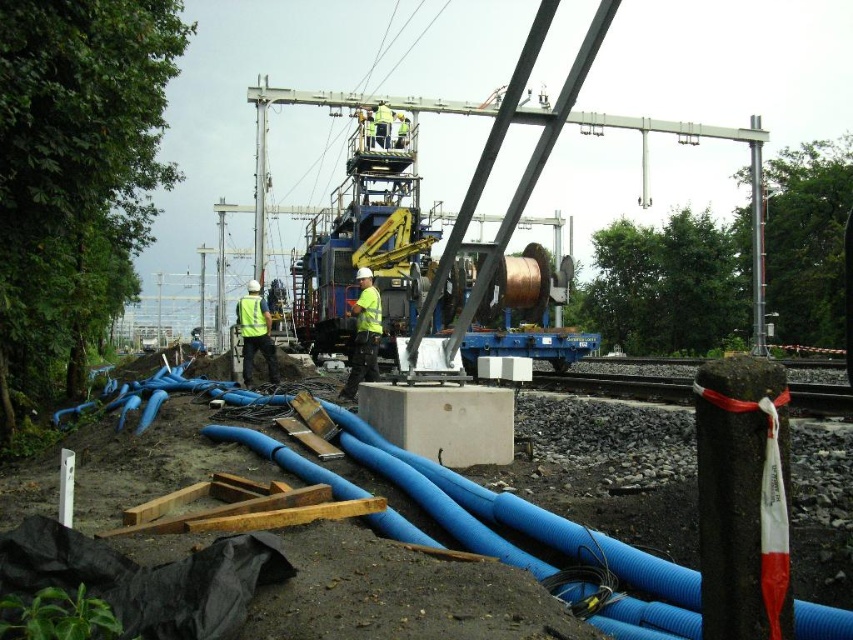
You are a safety inspector at the construction site. You notice the blue rubber pipes at lower left and the yellow reflective safety vest at center. According to safety regulations, all temporary pipes must be placed to the left of any active safety equipment. Is the current arrangement compliant with this rule?

The blue rubber pipes at lower left are positioned on the right side of the yellow reflective safety vest at center, which violates the safety regulation requiring temporary pipes to be placed to the left of active safety equipment. The arrangement is not compliant.

You are a safety inspector standing at the edge of the construction site. You notice a brushed metal pole at center and a yellow reflective safety vest at center. Which object is closer to your position?

The brushed metal pole at center is closer to you because it is further to the viewer than the yellow reflective safety vest at center.

You are a construction worker standing at the crane and looking towards the blue pipes. Which of the two points, point (245, 310) or point (263, 164), is closer to you?

Point (245, 310) is closer to the camera than point (263, 164), so it is closer to you.